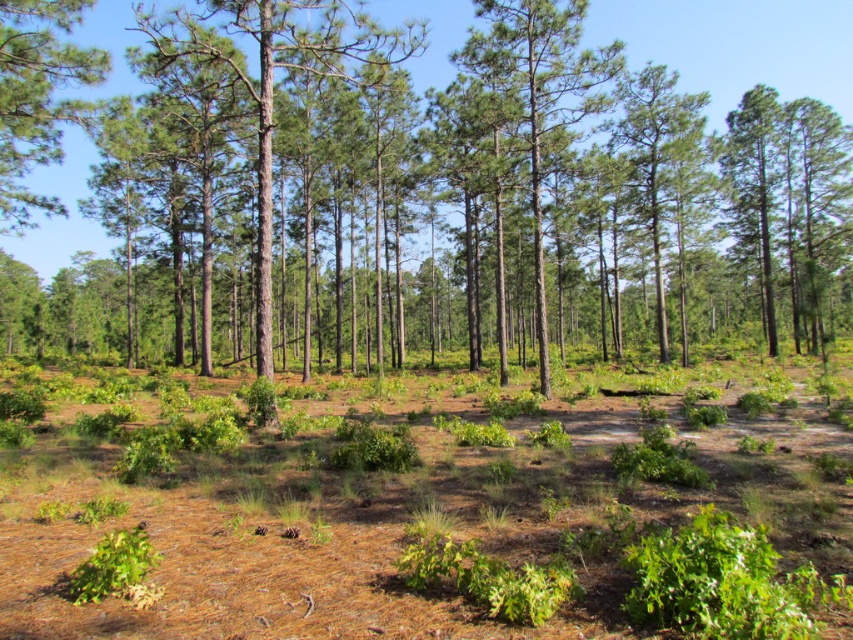
Does smooth brown tree trunk at center appear on the left side of green textured pine tree at center?

Indeed, smooth brown tree trunk at center is positioned on the left side of green textured pine tree at center.

Is smooth brown tree trunk at center bigger than green textured pine tree at center?

No, smooth brown tree trunk at center is not bigger than green textured pine tree at center.

What are the coordinates of `smooth brown tree trunk at center` in the screenshot? It's located at (271, 81).

Can you confirm if green textured pine tree at center is positioned to the left of green bark tree at upper left?

In fact, green textured pine tree at center is to the right of green bark tree at upper left.

Does point (535, 323) come farther from viewer compared to point (51, 96)?

Yes.

Where is `green textured pine tree at center`? This screenshot has height=640, width=853. green textured pine tree at center is located at coordinates (538, 93).

Does green textured tree at center have a smaller size compared to smooth brown tree trunk at center?

No, green textured tree at center is not smaller than smooth brown tree trunk at center.

From the picture: Who is positioned more to the right, green textured tree at center or smooth brown tree trunk at center?

green textured tree at center

Does point (712, 10) lie behind point (271, 20)?

Yes, it is behind point (271, 20).

I want to click on green textured tree at center, so click(x=735, y=45).